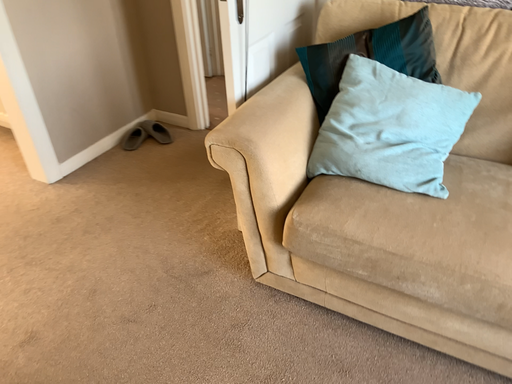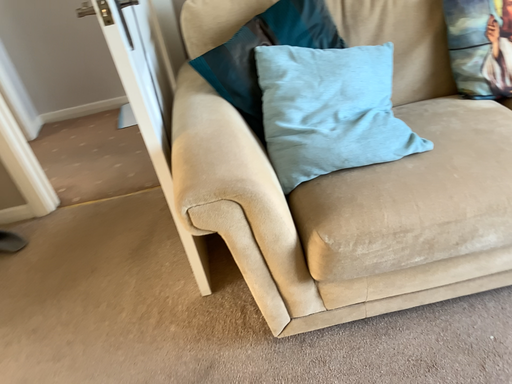
Question: Which way did the camera rotate in the video?

Choices:
 (A) rotated left
 (B) rotated right

Answer: (B)